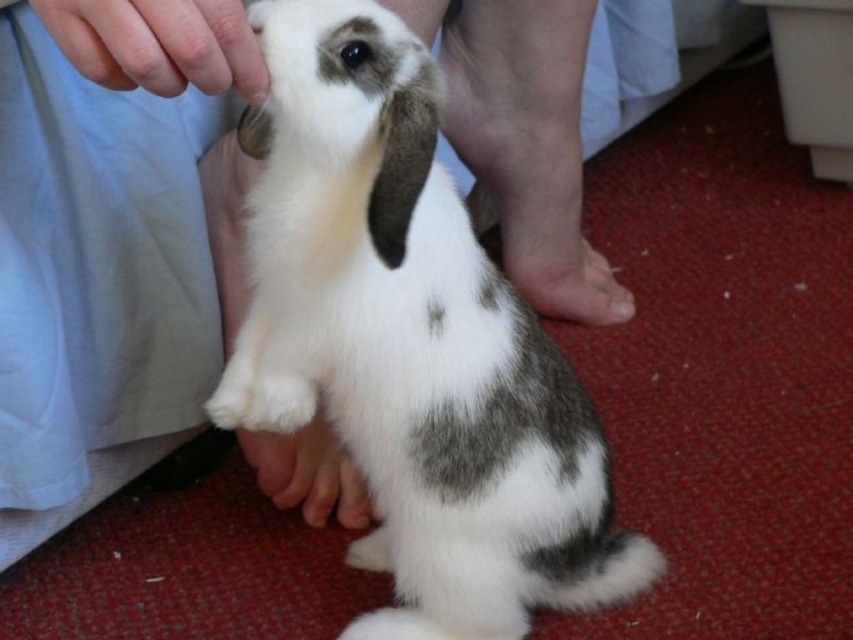
Question: Which point is closer to the camera?

Choices:
 (A) smooth skin at upper left
 (B) white-spotted fur rabbit at center
 (C) white fur paw at lower center
 (D) white soft skin at center

Answer: (A)

Question: Can you confirm if white-spotted fur rabbit at center is bigger than white soft skin at center?

Choices:
 (A) yes
 (B) no

Answer: (A)

Question: Is white-spotted fur rabbit at center below smooth skin at upper left?

Choices:
 (A) yes
 (B) no

Answer: (A)

Question: Which point is closer to the camera taking this photo?

Choices:
 (A) pyautogui.click(x=577, y=477)
 (B) pyautogui.click(x=242, y=189)
 (C) pyautogui.click(x=532, y=269)

Answer: (A)

Question: Considering the relative positions of white-spotted fur rabbit at center and white soft skin at center in the image provided, where is white-spotted fur rabbit at center located with respect to white soft skin at center?

Choices:
 (A) left
 (B) right

Answer: (B)

Question: Estimate the real-world distances between objects in this image. Which object is farther from the white fur paw at lower center?

Choices:
 (A) white-spotted fur rabbit at center
 (B) smooth skin at upper left

Answer: (B)